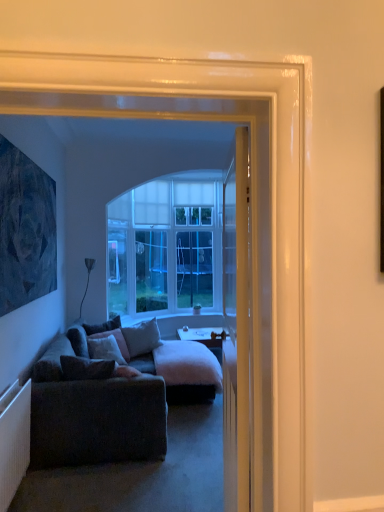
Question: Which direction should I rotate to look at velvet gray pillow at center, the 2th pillow from the front?

Choices:
 (A) left
 (B) right

Answer: (A)

Question: Is velvet brown pillow at center, which is counted as the first pillow, starting from the front, taller than dark blue textured painting at left?

Choices:
 (A) yes
 (B) no

Answer: (B)

Question: From a real-world perspective, is velvet brown pillow at center, which is counted as the first pillow, starting from the front, positioned under dark blue textured painting at left based on gravity?

Choices:
 (A) no
 (B) yes

Answer: (B)

Question: Considering the relative sizes of velvet brown pillow at center, which is counted as the first pillow, starting from the front, and dark blue textured painting at left in the image provided, is velvet brown pillow at center, which is counted as the first pillow, starting from the front, shorter than dark blue textured painting at left?

Choices:
 (A) yes
 (B) no

Answer: (A)

Question: Is velvet brown pillow at center, the 4th pillow positioned from the back, looking in the opposite direction of dark blue textured painting at left?

Choices:
 (A) no
 (B) yes

Answer: (A)

Question: From the image's perspective, is velvet brown pillow at center, which is counted as the first pillow, starting from the front, located above dark blue textured painting at left?

Choices:
 (A) no
 (B) yes

Answer: (A)

Question: Does velvet brown pillow at center, the 4th pillow positioned from the back, come in front of dark blue textured painting at left?

Choices:
 (A) no
 (B) yes

Answer: (A)

Question: Can we say dark blue textured painting at left lies outside clear glass door at center?

Choices:
 (A) no
 (B) yes

Answer: (B)

Question: From a real-world perspective, is dark blue textured painting at left over clear glass door at center?

Choices:
 (A) no
 (B) yes

Answer: (B)

Question: Considering the relative sizes of dark blue textured painting at left and clear glass door at center in the image provided, is dark blue textured painting at left shorter than clear glass door at center?

Choices:
 (A) no
 (B) yes

Answer: (B)

Question: From a real-world perspective, is dark blue textured painting at left physically below clear glass door at center?

Choices:
 (A) yes
 (B) no

Answer: (B)

Question: Considering the relative sizes of dark blue textured painting at left and clear glass door at center in the image provided, is dark blue textured painting at left taller than clear glass door at center?

Choices:
 (A) yes
 (B) no

Answer: (B)

Question: Can you confirm if dark blue textured painting at left is bigger than clear glass door at center?

Choices:
 (A) no
 (B) yes

Answer: (B)

Question: From the image's perspective, is smooth wooden desk at center over velvet gray pillow at center, the 2th pillow from the front?

Choices:
 (A) no
 (B) yes

Answer: (A)